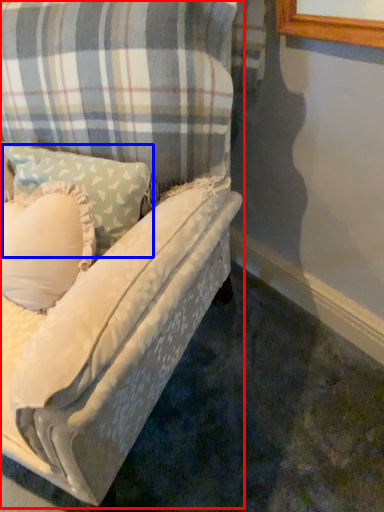
Question: Among these objects, which one is farthest to the camera, studio couch (highlighted by a red box) or pillow (highlighted by a blue box)?

Choices:
 (A) studio couch
 (B) pillow

Answer: (B)